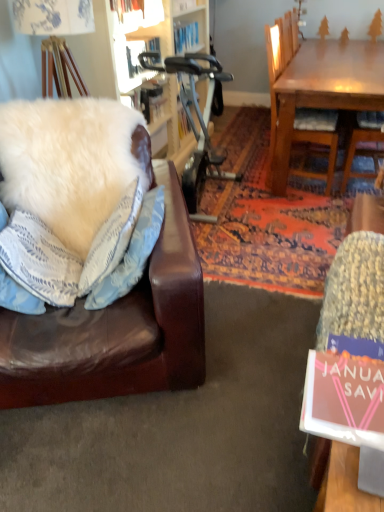
Question: From the image's perspective, is white fluffy pillow at left, positioned as the 3th pillow in right-to-left order, above pink matte book at lower right?

Choices:
 (A) yes
 (B) no

Answer: (A)

Question: Is pink matte book at lower right located within white fluffy pillow at left, positioned as the 3th pillow in right-to-left order?

Choices:
 (A) no
 (B) yes

Answer: (A)

Question: Is white fluffy pillow at left, positioned as the 3th pillow in right-to-left order, not inside pink matte book at lower right?

Choices:
 (A) no
 (B) yes

Answer: (B)

Question: Is white fluffy pillow at left, positioned as the 3th pillow in right-to-left order, aimed at pink matte book at lower right?

Choices:
 (A) no
 (B) yes

Answer: (A)

Question: Does white fluffy pillow at left, positioned as the 3th pillow in right-to-left order, appear on the left side of pink matte book at lower right?

Choices:
 (A) no
 (B) yes

Answer: (B)

Question: From a real-world perspective, is white fluffy pillow at left, which appears as the 1th pillow when viewed from the left, on pink matte book at lower right?

Choices:
 (A) yes
 (B) no

Answer: (B)

Question: From the image's perspective, is white fluffy pillow at left, the 2th pillow in the left-to-right sequence, located beneath white fluffy pillow at left, which ranks as the 1th pillow in right-to-left order?

Choices:
 (A) yes
 (B) no

Answer: (B)

Question: Would you consider white fluffy pillow at left, marked as the second pillow in a right-to-left arrangement, to be distant from white fluffy pillow at left, which ranks as the 1th pillow in right-to-left order?

Choices:
 (A) no
 (B) yes

Answer: (A)

Question: Would you say white fluffy pillow at left, marked as the second pillow in a right-to-left arrangement, contains white fluffy pillow at left, which ranks as the 3th pillow in left-to-right order?

Choices:
 (A) yes
 (B) no

Answer: (B)

Question: Is white fluffy pillow at left, the 2th pillow in the left-to-right sequence, looking in the opposite direction of white fluffy pillow at left, which ranks as the 3th pillow in left-to-right order?

Choices:
 (A) no
 (B) yes

Answer: (A)

Question: Is the depth of white fluffy pillow at left, the 2th pillow in the left-to-right sequence, less than that of white fluffy pillow at left, which ranks as the 1th pillow in right-to-left order?

Choices:
 (A) no
 (B) yes

Answer: (A)

Question: Does white fluffy pillow at left, marked as the second pillow in a right-to-left arrangement, have a greater width compared to white fluffy pillow at left, which ranks as the 1th pillow in right-to-left order?

Choices:
 (A) yes
 (B) no

Answer: (A)

Question: Is wooden chair at upper right oriented towards white fluffy pillow at left, positioned as the 3th pillow in right-to-left order?

Choices:
 (A) yes
 (B) no

Answer: (B)